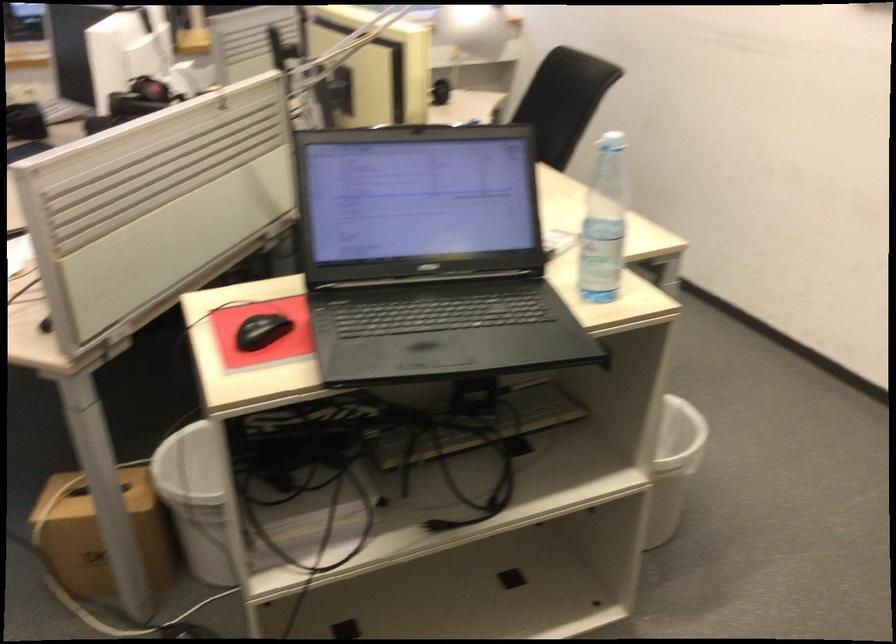
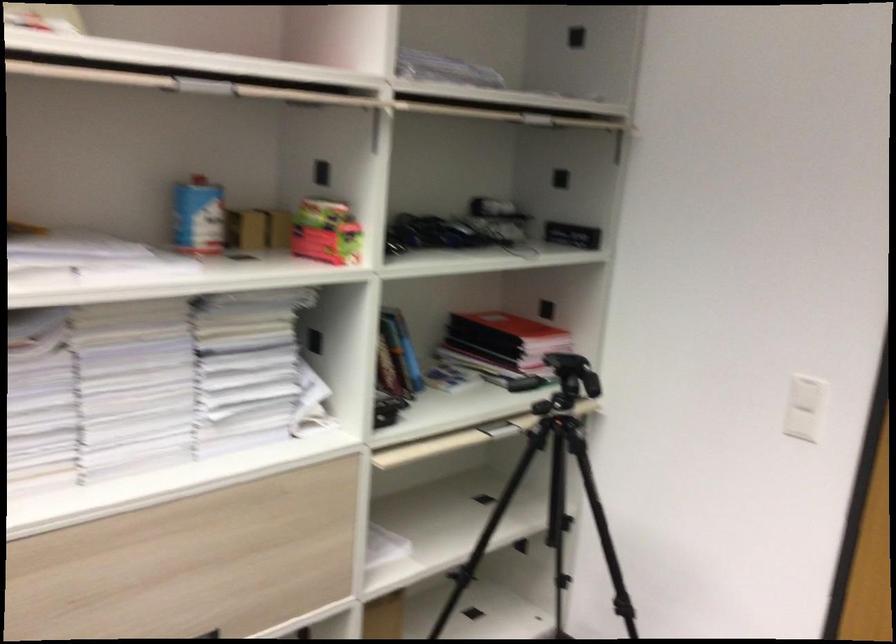
Based on the continuous images, in which direction is the camera rotating?

The camera rotated toward right-down.